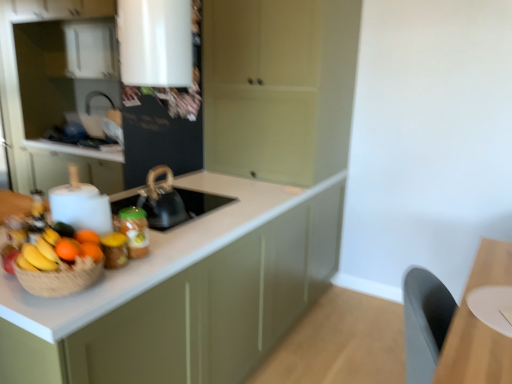
You are a GUI agent. You are given a task and a screenshot of the screen. Output one action in this format:
    pyautogui.click(x=<x>, y=<y>)
    Task: Click on the vacant space behind translucent glass jar at center
    The image size is (512, 384).
    Given the screenshot: What is the action you would take?
    coord(157,242)